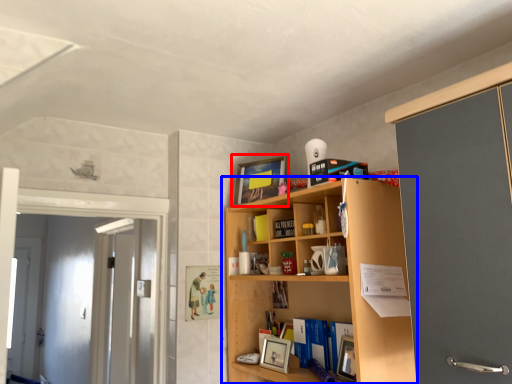
Question: Among these objects, which one is farthest to the camera, picture frame (highlighted by a red box) or shelf (highlighted by a blue box)?

Choices:
 (A) picture frame
 (B) shelf

Answer: (A)